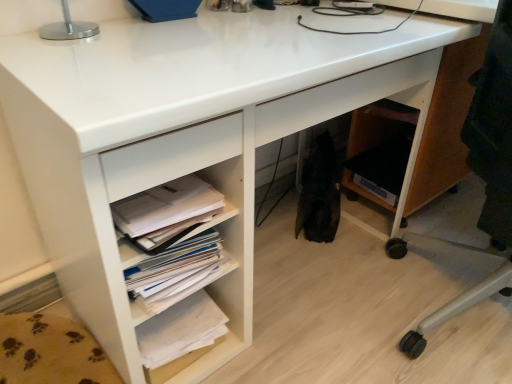
Question: From a real-world perspective, relative to wooden office chair at lower right, is white paper at lower left vertically above or below?

Choices:
 (A) below
 (B) above

Answer: (B)

Question: Is point (121, 261) positioned closer to the camera than point (510, 261)?

Choices:
 (A) farther
 (B) closer

Answer: (B)

Question: Which object is the farthest from the white paper stack at lower left, placed as the 1th book when sorted from bottom to top?

Choices:
 (A) white paper stack at lower center, marked as the 1th book in a top-to-bottom arrangement
 (B) wooden office chair at lower right
 (C) white paper at lower left
 (D) silver metallic table lamp at upper left

Answer: (D)

Question: Which is nearer to the wooden office chair at lower right?

Choices:
 (A) white paper at lower left
 (B) silver metallic table lamp at upper left
 (C) white paper stack at lower left, which appears as the second book when viewed from the top
 (D) white paper stack at lower center, placed as the second book when sorted from bottom to top

Answer: (A)